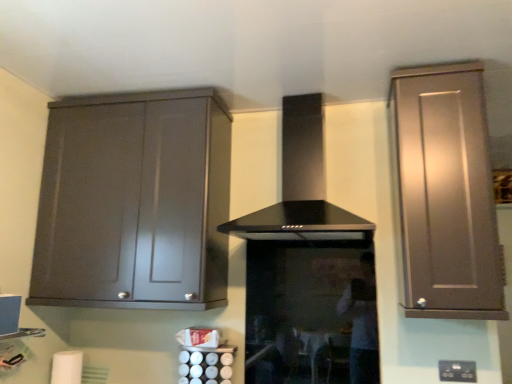
Question: Does point (53, 367) appear closer or farther from the camera than point (181, 352)?

Choices:
 (A) farther
 (B) closer

Answer: (B)

Question: In terms of size, does white matte toilet paper at lower left appear bigger or smaller than satin silver canisters at lower center?

Choices:
 (A) small
 (B) big

Answer: (A)

Question: Estimate the real-world distances between objects in this image. Which object is farther from the satin silver canisters at lower center?

Choices:
 (A) black glass range hood at center
 (B) matte gray cabinet at left, the 2th cabinetry when ordered from right to left
 (C) white matte toilet paper at lower left
 (D) satin brown cabinet at right, which is the 1th cabinetry in right-to-left order
 (E) black plastic electric outlet at lower right

Answer: (D)

Question: Considering the real-world distances, which object is farthest from the black glass range hood at center?

Choices:
 (A) matte gray cabinet at left, the 2th cabinetry when ordered from right to left
 (B) black plastic electric outlet at lower right
 (C) satin brown cabinet at right, placed as the 2th cabinetry when sorted from left to right
 (D) satin silver canisters at lower center
 (E) white matte toilet paper at lower left

Answer: (E)